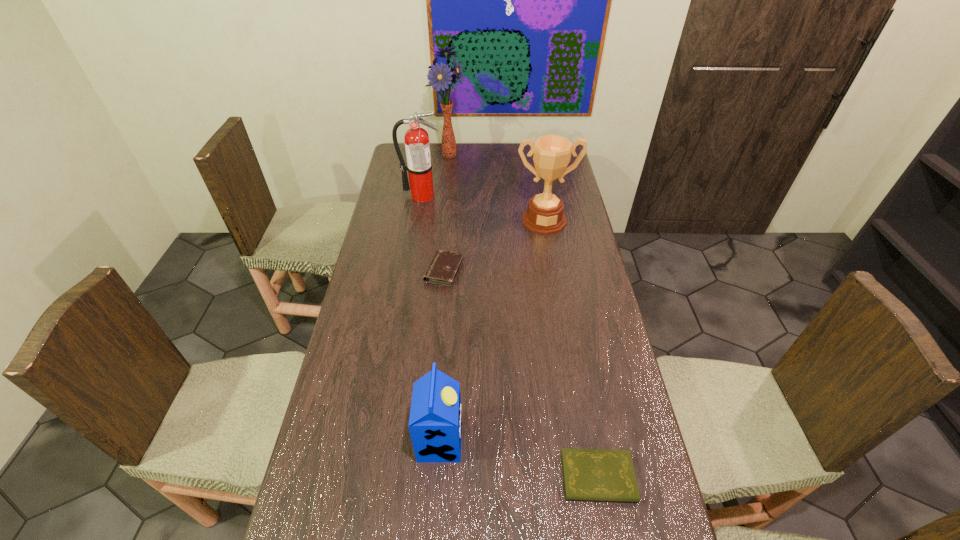
The width and height of the screenshot is (960, 540). In order to click on the tallest object in this screenshot , I will do tap(440, 76).

You are a GUI agent. You are given a task and a screenshot of the screen. Output one action in this format:
    pyautogui.click(x=<x>, y=<y>)
    Task: Click on the farthest object
    The width and height of the screenshot is (960, 540).
    Given the screenshot: What is the action you would take?
    pyautogui.click(x=440, y=76)

Locate an element on the screen. the fifth nearest object is located at coordinates (417, 146).

Locate an element on the screen. The image size is (960, 540). award is located at coordinates (551, 154).

Locate an element on the screen. The height and width of the screenshot is (540, 960). carton is located at coordinates (435, 424).

Where is `the taller diary`? The image size is (960, 540). the taller diary is located at coordinates (443, 269).

Identify the location of the farther diary. (443, 269).

Locate an element on the screen. The image size is (960, 540). the nearer diary is located at coordinates (588, 474).

Find the location of `the shortest object`. the shortest object is located at coordinates (588, 474).

At what (x,y) coordinates should I click in order to perform the action: click on free spot located 0.150m on the left of the farthest object. Please return your answer as a coordinate pair (x, y). Image resolution: width=960 pixels, height=540 pixels. Looking at the image, I should click on (398, 155).